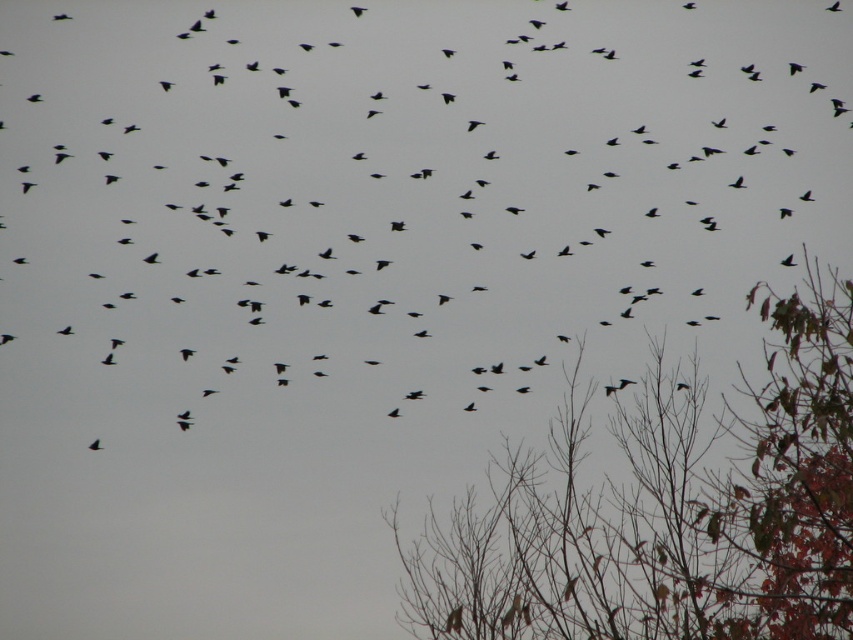
You are an ornithologist observing the scene. You notice the black matte birds at center and the brown leafy tree at lower right. Which object is closer to you, the observer?

The black matte birds at center are closer to you than the brown leafy tree at lower right because they are positioned further to the viewer in the scene.

You are a birdwatcher observing the scene. You notice the black matte birds at center and the brown leafy tree at lower right. Which object is positioned higher in the image?

The black matte birds at center is located above the brown leafy tree at lower right, so it is positioned higher in the image.

You are standing in the forest looking up at the birds. There are two points in the sky where birds are flying. One is at point (848,244) and the other is at point (787,593). Which point is closer to you?

A: Point (787,593) is closer to you because point (848,244) is behind it.